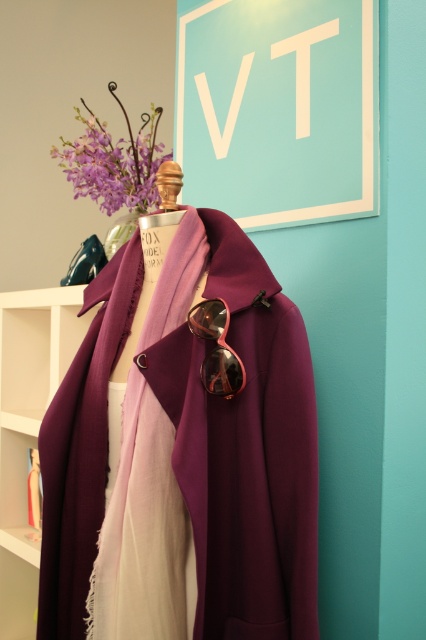
Is purple matte scarf at center below purple matte vase at upper center?

Yes.

Who is shorter, purple matte scarf at center or purple matte vase at upper center?

With less height is purple matte vase at upper center.

Is point (138, 388) less distant than point (120, 156)?

Yes, point (138, 388) is in front of point (120, 156).

This screenshot has height=640, width=426. Identify the location of purple matte scarf at center. pyautogui.click(x=147, y=465).

Can you confirm if matte purple coat at center is positioned above shiny metallic goggles at center?

No.

Does matte purple coat at center appear on the right side of shiny metallic goggles at center?

In fact, matte purple coat at center is to the left of shiny metallic goggles at center.

Who is more forward, (299, 525) or (222, 352)?

Positioned in front is point (299, 525).

Where is `matte purple coat at center`? The height and width of the screenshot is (640, 426). matte purple coat at center is located at coordinates click(x=183, y=456).

Is matte purple coat at center above purple matte vase at upper center?

No.

Does matte purple coat at center have a greater width compared to purple matte vase at upper center?

Incorrect, matte purple coat at center's width does not surpass purple matte vase at upper center's.

Is point (267, 404) positioned behind point (138, 144)?

That is False.

Image resolution: width=426 pixels, height=640 pixels. Identify the location of matte purple coat at center. (183, 456).